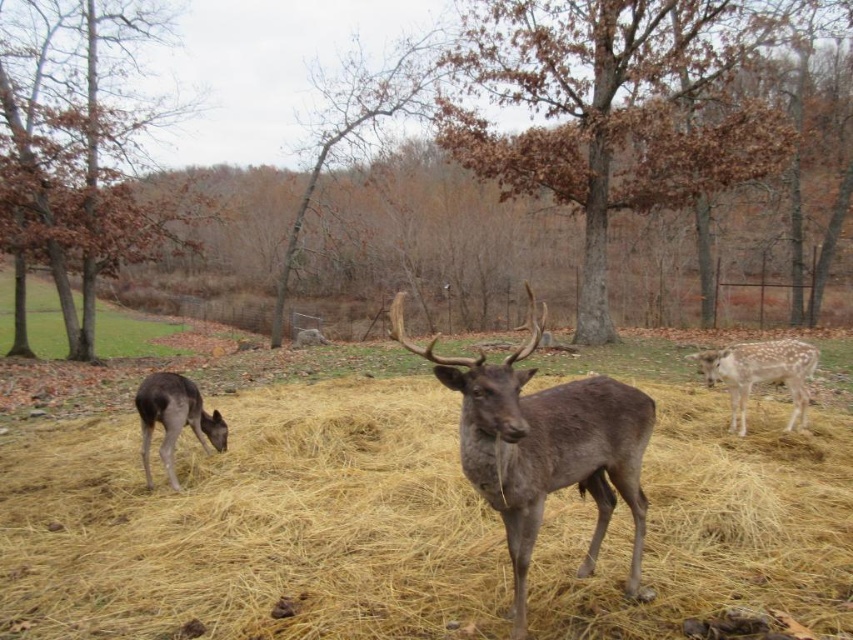
You are standing at the center of the image and want to walk towards the green grass at lower left. Which direction should you face to head directly towards it?

You should face the lower left direction to head directly towards the green grass at lower left since it is located at point (135, 333), which is in the lower left area of the image.

You are a wildlife photographer aiming to capture a photo of both the spotted fur deer at right and the gray matte deer at lower left in the same frame. Based on their positions, which deer should you focus on first to ensure both are in the shot?

The spotted fur deer at right is positioned on the right side of gray matte deer at lower left, so you should focus on the gray matte deer at lower left first to ensure both are in the shot.

You are standing in the autumn scene with three deer. You see a mature buck with large antlers in the foreground, a smaller deer grazing on the left, and a spotted fur deer marked at point [759,374]. Which deer has the darkest coat?

The mature buck with large antlers has the darkest coat as it blends with the earthy tones of the environment, while the smaller deer has a lighter hue and the spotted fur deer at right has a different pattern.